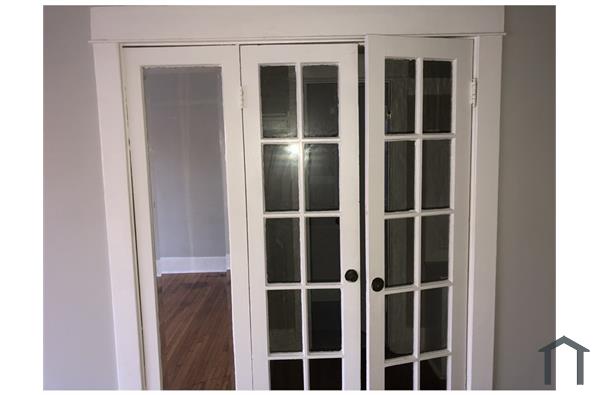
Locate an element on the screen. The height and width of the screenshot is (395, 600). wall is located at coordinates (183, 217).